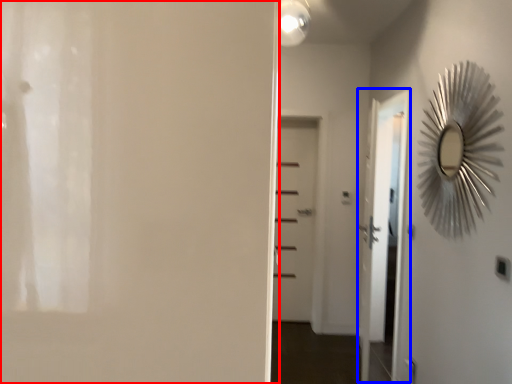
Question: Which object appears farthest to the camera in this image, door (highlighted by a red box) or screen door (highlighted by a blue box)?

Choices:
 (A) door
 (B) screen door

Answer: (B)